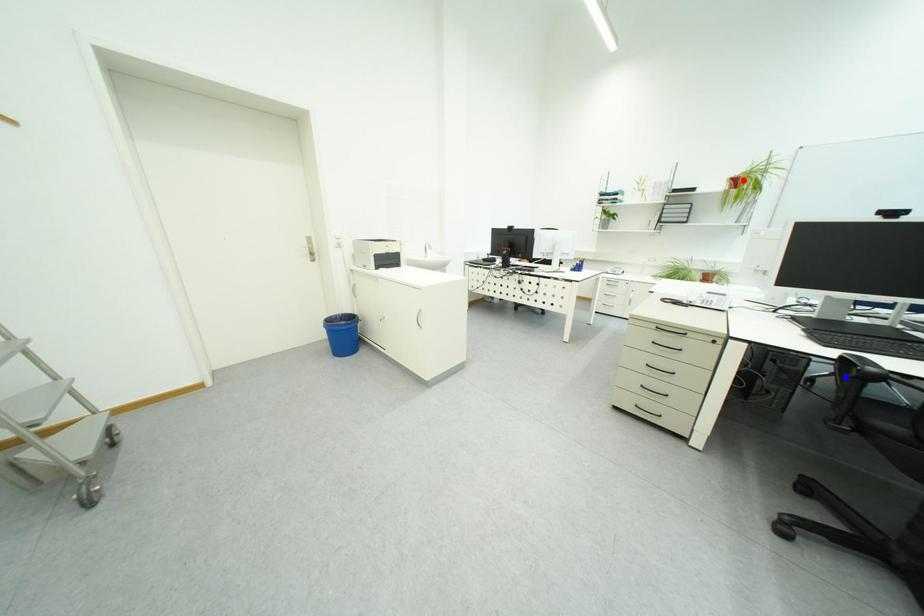
Question: Which of the two points in the image is closer to the camera?

Choices:
 (A) Blue point is closer.
 (B) Red point is closer.

Answer: (A)